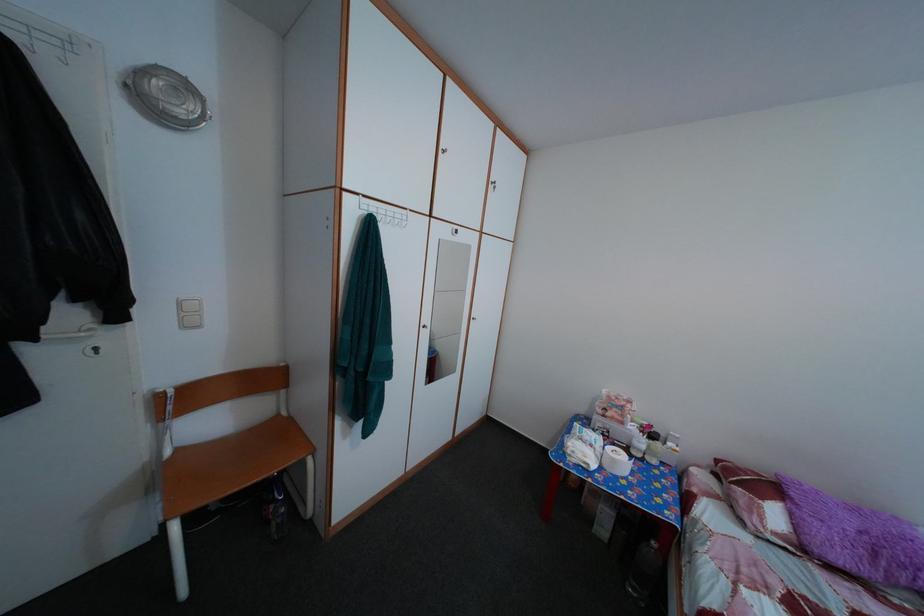
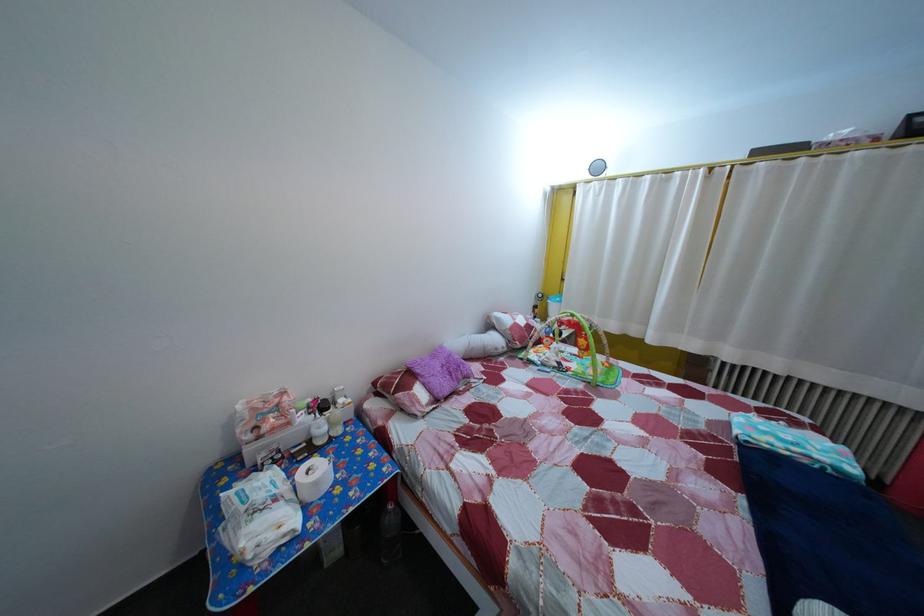
Find the pixel in the second image that matches pixel 631 431 in the first image.

(298, 432)